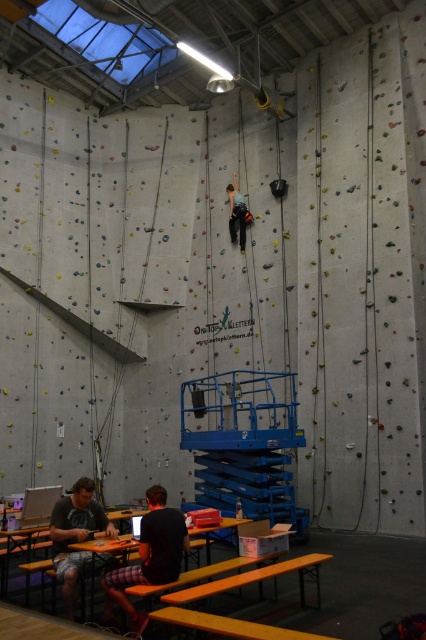
Question: Is black cotton shirt at lower center positioned before gray cotton t-shirt at lower left?

Choices:
 (A) yes
 (B) no

Answer: (A)

Question: Which point is farther to the camera?

Choices:
 (A) (132, 612)
 (B) (245, 216)
 (C) (89, 516)

Answer: (B)

Question: Is black cotton shirt at lower center below green fabric climbing harness at center?

Choices:
 (A) yes
 (B) no

Answer: (A)

Question: Considering the real-world distances, which object is farthest from the green fabric climbing harness at center?

Choices:
 (A) black cotton shirt at lower center
 (B) gray cotton t-shirt at lower left

Answer: (A)

Question: Which of these objects is positioned closest to the gray cotton t-shirt at lower left?

Choices:
 (A) black cotton shirt at lower center
 (B) green fabric climbing harness at center

Answer: (A)

Question: Is black cotton shirt at lower center above green fabric climbing harness at center?

Choices:
 (A) no
 (B) yes

Answer: (A)